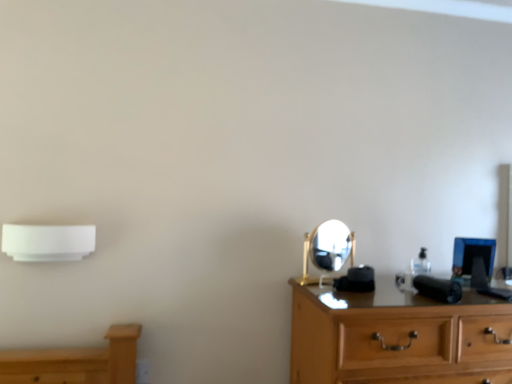
Question: Should I look upward or downward to see gold metallic mirror at center?

Choices:
 (A) up
 (B) down

Answer: (B)

Question: Is wooden chest of drawers at right placed right next to gold metallic mirror at center?

Choices:
 (A) no
 (B) yes

Answer: (A)

Question: Does wooden chest of drawers at right have a larger size compared to gold metallic mirror at center?

Choices:
 (A) yes
 (B) no

Answer: (A)

Question: Can you confirm if wooden chest of drawers at right is shorter than gold metallic mirror at center?

Choices:
 (A) yes
 (B) no

Answer: (B)

Question: Is the position of wooden chest of drawers at right more distant than that of gold metallic mirror at center?

Choices:
 (A) no
 (B) yes

Answer: (A)

Question: Can you confirm if wooden chest of drawers at right is wider than gold metallic mirror at center?

Choices:
 (A) yes
 (B) no

Answer: (A)

Question: Does wooden chest of drawers at right turn towards gold metallic mirror at center?

Choices:
 (A) yes
 (B) no

Answer: (B)

Question: Does white plastic air conditioner at left have a greater height compared to white plastic electric outlet at lower left?

Choices:
 (A) no
 (B) yes

Answer: (B)

Question: Does white plastic air conditioner at left have a smaller size compared to white plastic electric outlet at lower left?

Choices:
 (A) no
 (B) yes

Answer: (A)

Question: Does white plastic air conditioner at left come behind white plastic electric outlet at lower left?

Choices:
 (A) yes
 (B) no

Answer: (B)

Question: Is white plastic air conditioner at left at the right side of white plastic electric outlet at lower left?

Choices:
 (A) yes
 (B) no

Answer: (B)

Question: From the image's perspective, is white plastic air conditioner at left over white plastic electric outlet at lower left?

Choices:
 (A) yes
 (B) no

Answer: (A)

Question: Is white plastic air conditioner at left positioned before white plastic electric outlet at lower left?

Choices:
 (A) no
 (B) yes

Answer: (B)

Question: From the image's perspective, does white plastic air conditioner at left appear lower than wooden chest of drawers at right?

Choices:
 (A) no
 (B) yes

Answer: (A)